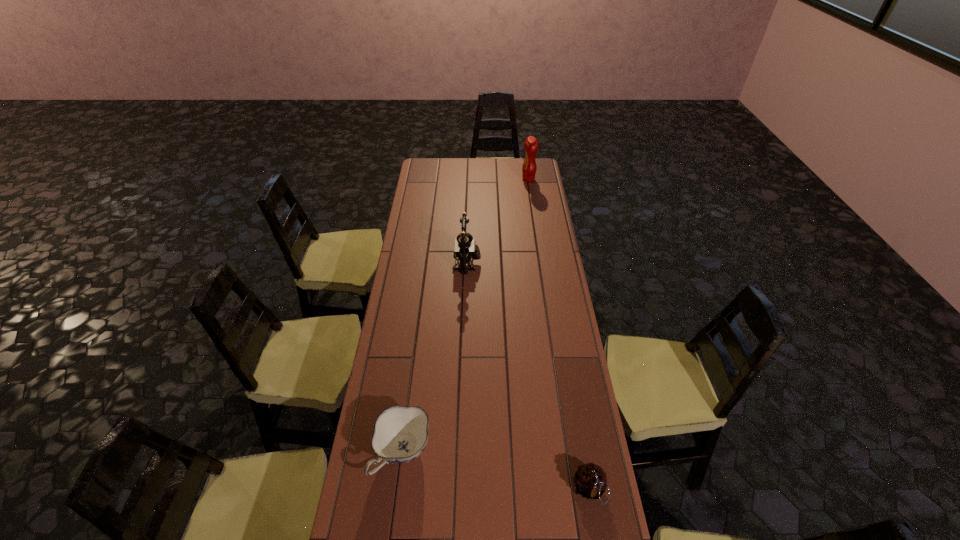
Image resolution: width=960 pixels, height=540 pixels. Identify the location of empty space between the farthest object and the pinecone. (559, 334).

Locate an element on the screen. This screenshot has height=540, width=960. empty location between the farthest object and the chinaware is located at coordinates (466, 316).

The width and height of the screenshot is (960, 540). What are the coordinates of `free space between the pinecone and the condiment` in the screenshot? It's located at (559, 334).

This screenshot has width=960, height=540. I want to click on free space between the pinecone and the condiment, so click(559, 334).

This screenshot has height=540, width=960. In order to click on unoccupied position between the farthest object and the chinaware in this screenshot , I will do `click(466, 316)`.

Where is `free space between the farthest object and the chinaware`? This screenshot has width=960, height=540. free space between the farthest object and the chinaware is located at coordinates (466, 316).

The image size is (960, 540). I want to click on free space between the third nearest object and the chinaware, so click(x=435, y=358).

Where is `vacant space that is in between the pinecone and the second object from left to right`? vacant space that is in between the pinecone and the second object from left to right is located at coordinates (528, 376).

Where is `unoccupied area between the telephone and the farthest object`? The image size is (960, 540). unoccupied area between the telephone and the farthest object is located at coordinates (497, 221).

What are the coordinates of `the second closest object relative to the condiment` in the screenshot? It's located at (x=400, y=435).